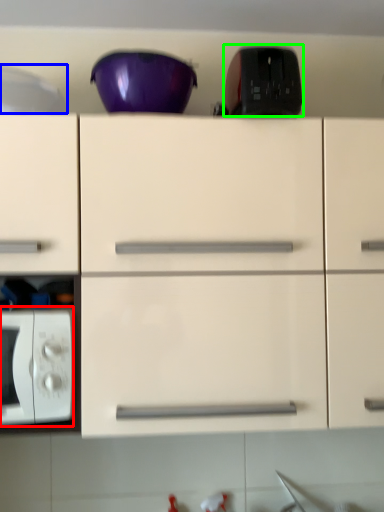
Question: Which object is the farthest from microwave oven (highlighted by a red box)? Choose among these: appliance (highlighted by a blue box) or appliance (highlighted by a green box).

Choices:
 (A) appliance
 (B) appliance

Answer: (B)